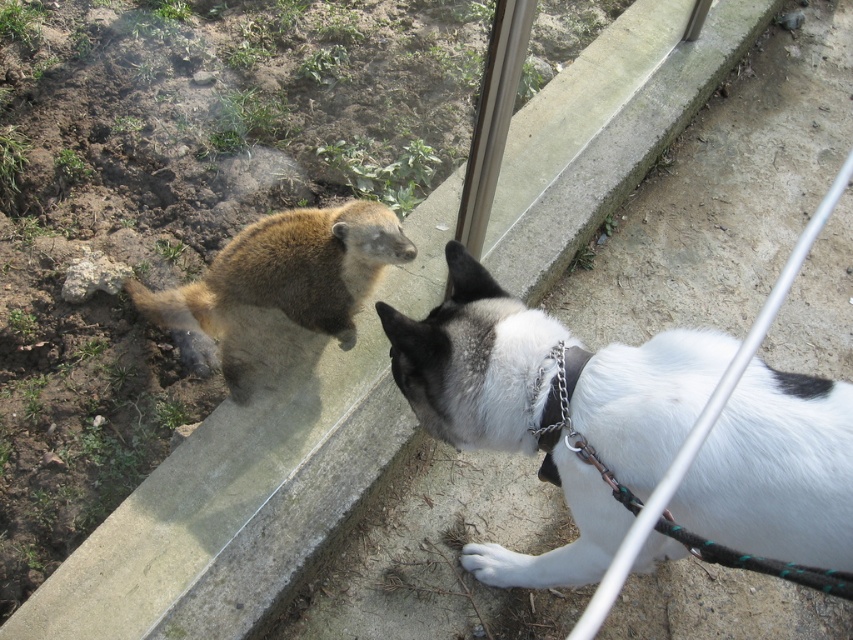
You are a zookeeper trying to determine if the white fur dog at lower right can fit through a narrow opening that the white fur paw at lower center can pass through. Based on their sizes, what would you conclude?

The white fur dog at lower right might be wider than white fur paw at lower center, so it may not fit through the opening that the white fur paw at lower center can pass through.

You are a zookeeper who needs to clean the enclosure. You see the white fur dog at lower right and the transparent glass door at upper center. Which object is located to the right of the other?

The white fur dog at lower right is positioned on the right side of transparent glass door at upper center, so the white fur dog at lower right is to the right of the transparent glass door at upper center.

You are a zookeeper observing the interaction between the white fur dog at lower right and the white fur paw at lower center. Which animal is taller?

The white fur dog at lower right is taller than the white fur paw at lower center according to the description.